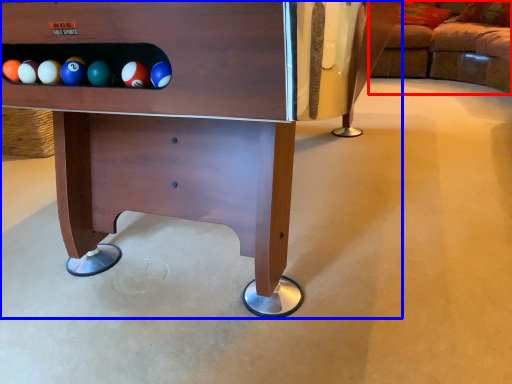
Question: Among these objects, which one is farthest to the camera, studio couch (highlighted by a red box) or furniture (highlighted by a blue box)?

Choices:
 (A) studio couch
 (B) furniture

Answer: (A)